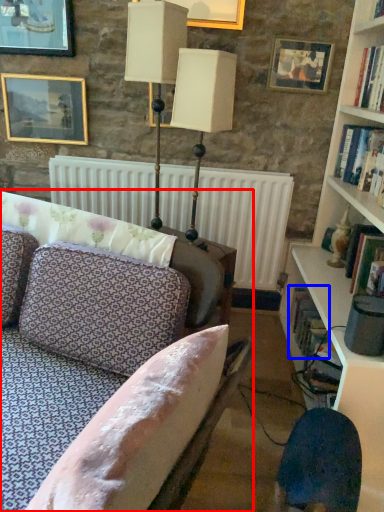
Question: Which point is closer to the camera, studio couch (highlighted by a red box) or book (highlighted by a blue box)?

Choices:
 (A) studio couch
 (B) book

Answer: (A)